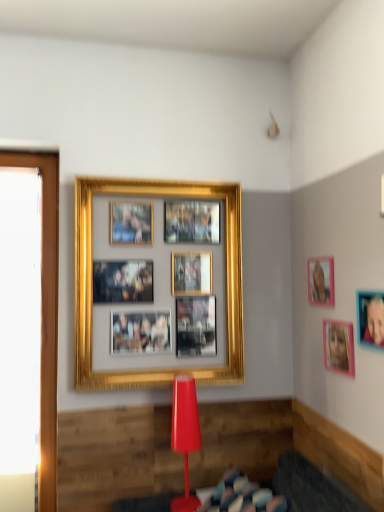
Question: Could you tell me if pink matte picture frame at upper right, the 2th picture frame when ordered from left to right, is facing gold metallic picture frame at upper center, the first picture frame from the back?

Choices:
 (A) no
 (B) yes

Answer: (B)

Question: Is pink matte picture frame at upper right, which appears as the 3th picture frame when viewed from the right, at the right side of gold metallic picture frame at upper center, acting as the first picture frame starting from the left?

Choices:
 (A) yes
 (B) no

Answer: (A)

Question: Is pink matte picture frame at upper right, which appears as the 3th picture frame when viewed from the right, next to gold metallic picture frame at upper center, which is the 4th picture frame from right to left?

Choices:
 (A) yes
 (B) no

Answer: (B)

Question: Is pink matte picture frame at upper right, acting as the 3th picture frame starting from the front, at the left side of gold metallic picture frame at upper center, the first picture frame from the back?

Choices:
 (A) yes
 (B) no

Answer: (B)

Question: From a real-world perspective, is pink matte picture frame at upper right, acting as the 2th picture frame starting from the back, physically above gold metallic picture frame at upper center, the first picture frame from the back?

Choices:
 (A) yes
 (B) no

Answer: (A)

Question: From the image's perspective, is transparent glass window at left located above or below pink matte picture frame at upper right, the 1th picture frame viewed from the right?

Choices:
 (A) below
 (B) above

Answer: (A)

Question: From a real-world perspective, relative to pink matte picture frame at upper right, positioned as the first picture frame in front-to-back order, is transparent glass window at left vertically above or below?

Choices:
 (A) above
 (B) below

Answer: (B)

Question: In terms of height, does transparent glass window at left look taller or shorter compared to pink matte picture frame at upper right, the 1th picture frame viewed from the right?

Choices:
 (A) short
 (B) tall

Answer: (B)

Question: Is transparent glass window at left bigger or smaller than pink matte picture frame at upper right, the 4th picture frame positioned from the left?

Choices:
 (A) small
 (B) big

Answer: (B)

Question: From a real-world perspective, is gold metallic picture frame at upper center, the first picture frame from the back, physically located above or below rubberized plastic stool at lower center?

Choices:
 (A) above
 (B) below

Answer: (A)

Question: In terms of width, does gold metallic picture frame at upper center, acting as the first picture frame starting from the left, look wider or thinner when compared to rubberized plastic stool at lower center?

Choices:
 (A) wide
 (B) thin

Answer: (B)

Question: Is point (163, 190) positioned closer to the camera than point (139, 509)?

Choices:
 (A) closer
 (B) farther

Answer: (B)

Question: From their relative heights in the image, would you say gold metallic picture frame at upper center, the first picture frame from the back, is taller or shorter than rubberized plastic stool at lower center?

Choices:
 (A) tall
 (B) short

Answer: (A)

Question: Looking at their shapes, would you say transparent glass window at left is wider or thinner than pink matte picture frame at upper right, which appears as the 2th picture frame when viewed from the front?

Choices:
 (A) thin
 (B) wide

Answer: (B)

Question: Is transparent glass window at left taller or shorter than pink matte picture frame at upper right, which appears as the 3th picture frame when viewed from the back?

Choices:
 (A) short
 (B) tall

Answer: (B)